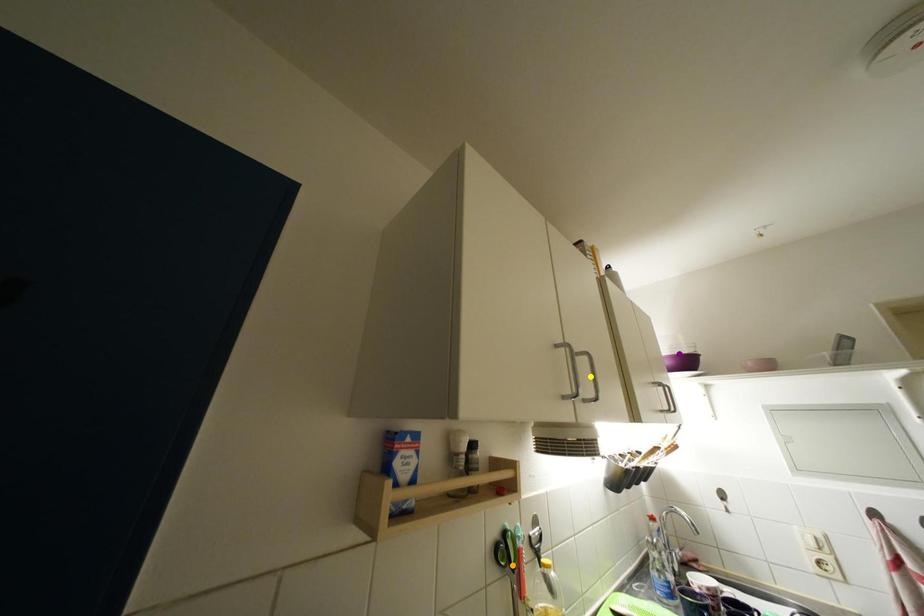
Order these from nearest to farthest:
1. yellow point
2. orange point
3. purple point

purple point < orange point < yellow point